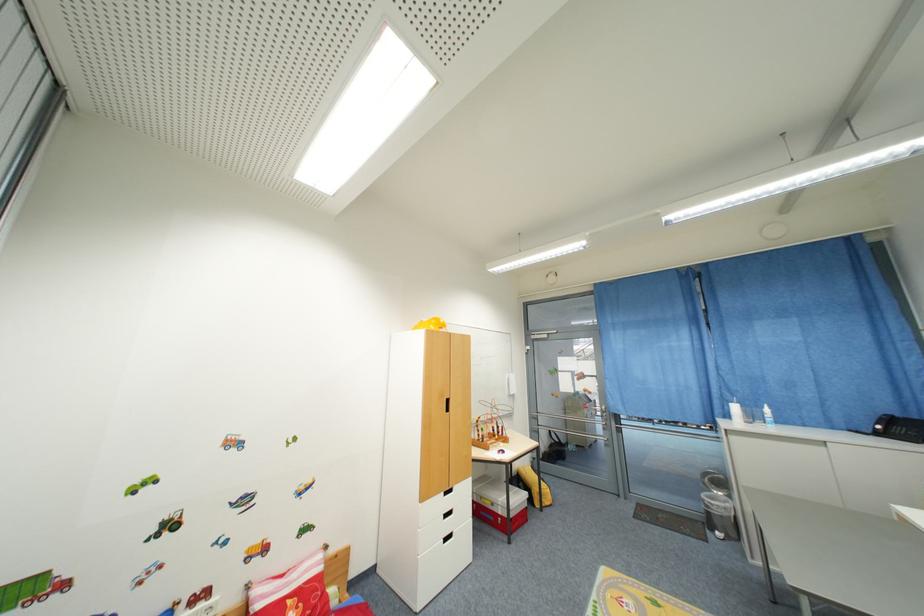
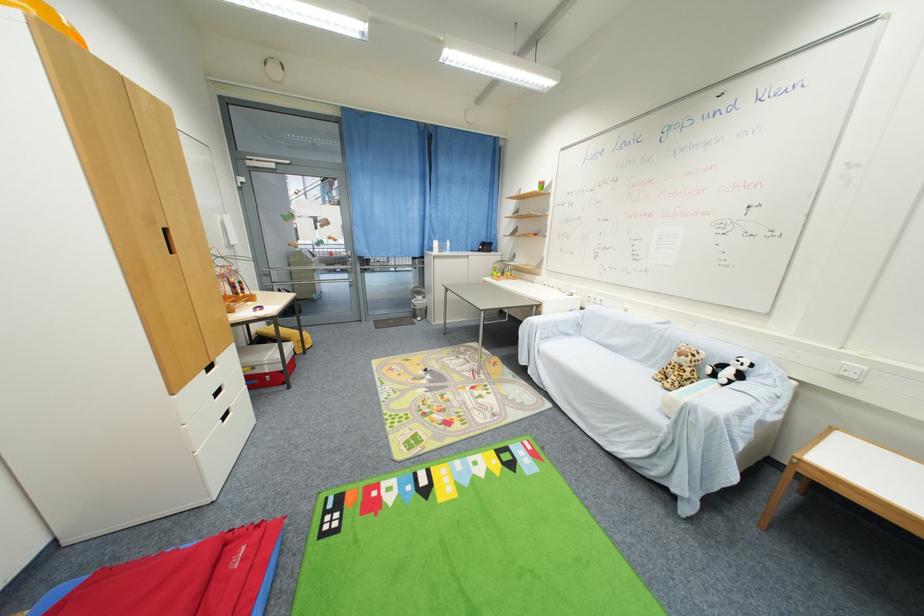
Based on the continuous images, in which direction is the camera rotating?

The rotation direction of the camera is right-down.